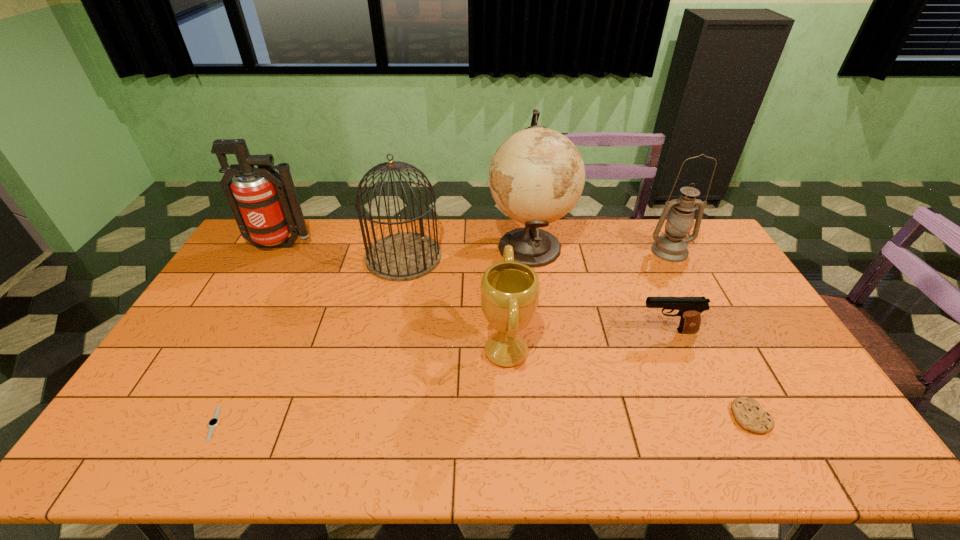
You are a GUI agent. You are given a task and a screenshot of the screen. Output one action in this format:
    pyautogui.click(x=<x>, y=<y>)
    Task: Click on the globe
    Image resolution: width=960 pixels, height=540 pixels.
    Given the screenshot: What is the action you would take?
    pyautogui.click(x=537, y=175)

Locate an element on the screen. fire extinguisher is located at coordinates (268, 211).

Identify the location of the sixth object from right to left. This screenshot has width=960, height=540. (406, 256).

Locate an element on the screen. oil lamp is located at coordinates (672, 246).

This screenshot has width=960, height=540. What are the coordinates of `the fifth tallest object` in the screenshot? It's located at (510, 290).

The height and width of the screenshot is (540, 960). I want to click on pistol, so click(690, 308).

At what (x,y) coordinates should I click in order to perform the action: click on cookie. Please return your answer as a coordinate pair (x, y). This screenshot has width=960, height=540. Looking at the image, I should click on (749, 414).

Locate an element on the screen. Image resolution: width=960 pixels, height=540 pixels. watch is located at coordinates click(x=214, y=421).

Where is `vacant point located on the front-facing side of the globe`? Image resolution: width=960 pixels, height=540 pixels. vacant point located on the front-facing side of the globe is located at coordinates (463, 246).

Locate an element on the screen. The image size is (960, 540). vacant area situated 0.220m on the front-facing side of the globe is located at coordinates (428, 246).